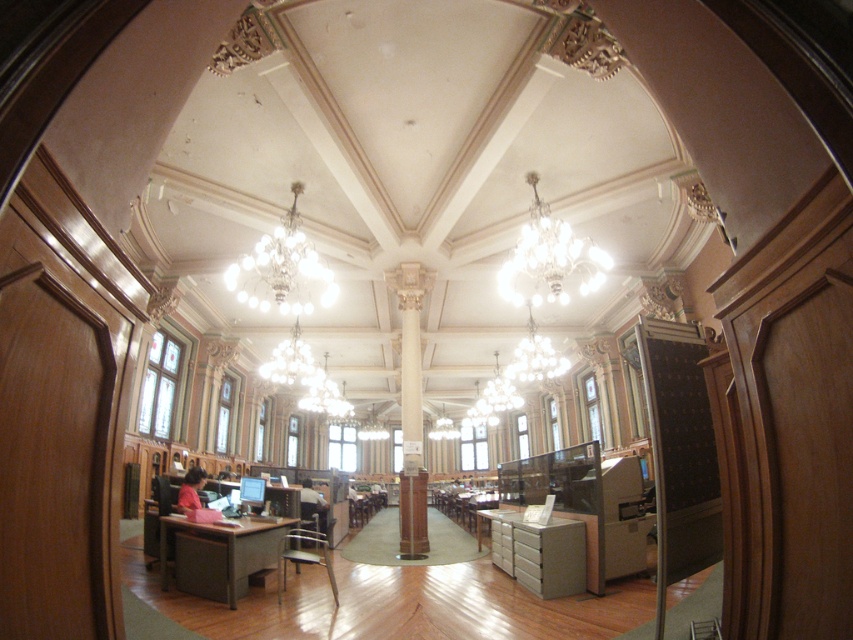
What do you see at coordinates (282, 268) in the screenshot? The width and height of the screenshot is (853, 640). I see `silver metallic chandelier at upper center` at bounding box center [282, 268].

Is silver metallic chandelier at upper center shorter than matte gold chandelier at center?

Yes.

Is point (312, 253) positioned before point (309, 362)?

Yes, it is in front of point (309, 362).

In order to click on silver metallic chandelier at upper center in this screenshot , I will do `click(282, 268)`.

Is silver metallic chandelier at upper center above white glass chandelier at center?

Yes.

Which is behind, point (303, 243) or point (524, 339)?

Positioned behind is point (524, 339).

Find the location of a particular element. Image resolution: width=853 pixels, height=640 pixels. silver metallic chandelier at upper center is located at coordinates (282, 268).

Describe the element at coordinates (535, 356) in the screenshot. This screenshot has height=640, width=853. I see `white glass chandelier at center` at that location.

Is white glass chandelier at center thinner than matte gold chandelier at center?

Correct, white glass chandelier at center's width is less than matte gold chandelier at center's.

Image resolution: width=853 pixels, height=640 pixels. Describe the element at coordinates (535, 356) in the screenshot. I see `white glass chandelier at center` at that location.

This screenshot has height=640, width=853. In order to click on white glass chandelier at center in this screenshot , I will do `click(535, 356)`.